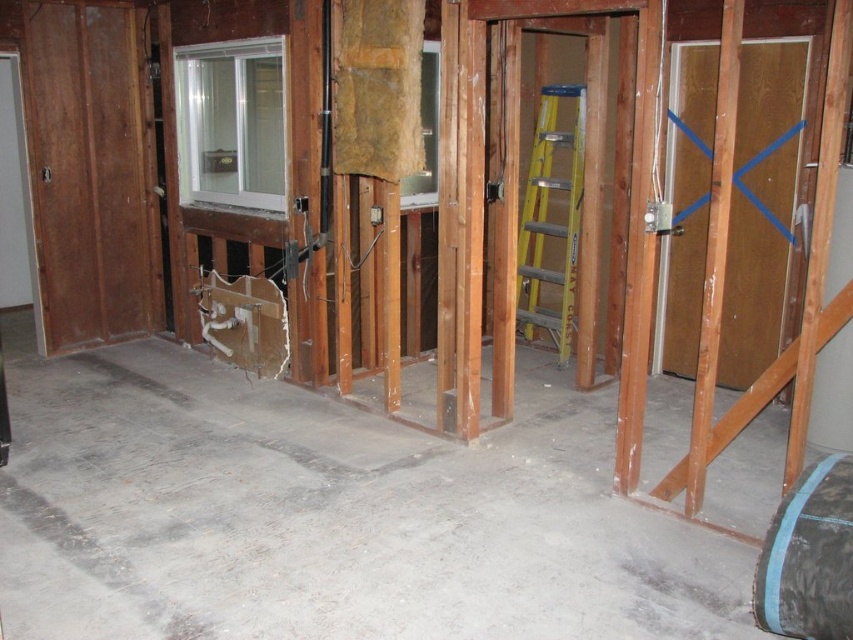
Is gray concrete floor at lower left smaller than yellow/yellowish metallic ladder at center-right?

Actually, gray concrete floor at lower left might be larger than yellow/yellowish metallic ladder at center-right.

Describe the element at coordinates (328, 515) in the screenshot. I see `gray concrete floor at lower left` at that location.

Does point (289, 472) come closer to viewer compared to point (556, 284)?

Yes, it is in front of point (556, 284).

Locate an element on the screen. gray concrete floor at lower left is located at coordinates (328, 515).